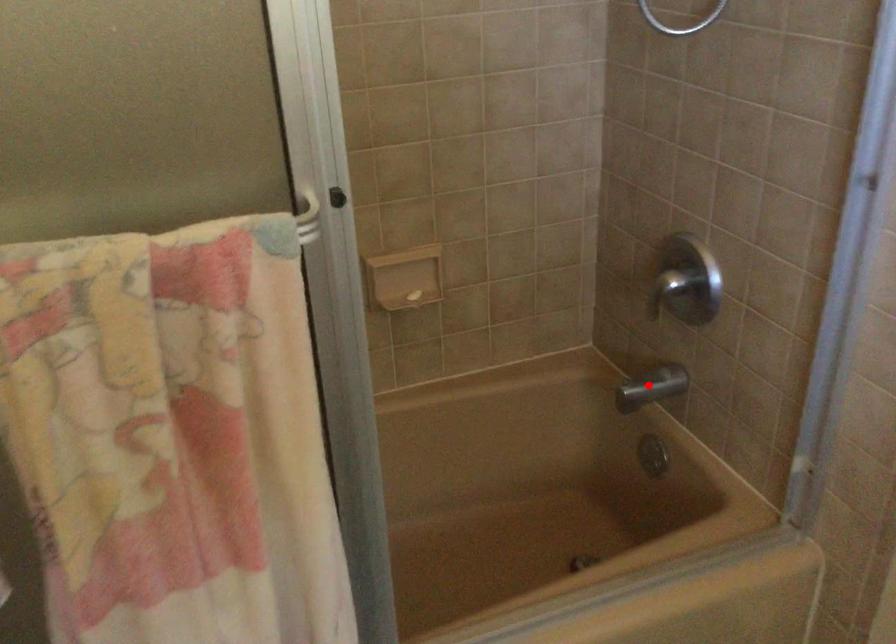
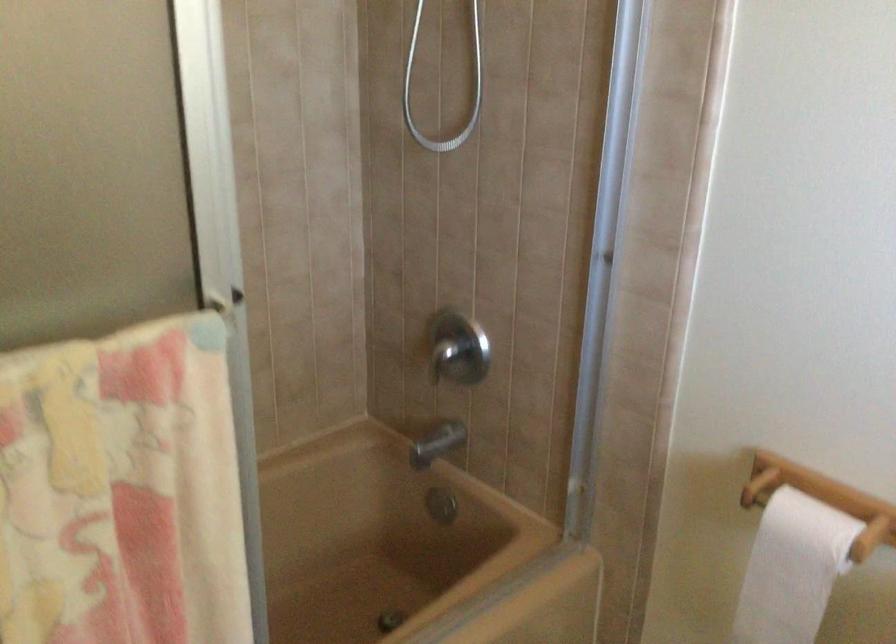
Question: I am providing you with two images of the same scene from different viewpoints. A red point is marked on the first image. At the location where the point appears in image 1, is it still visible in image 2?

Choices:
 (A) Yes
 (B) No

Answer: (A)